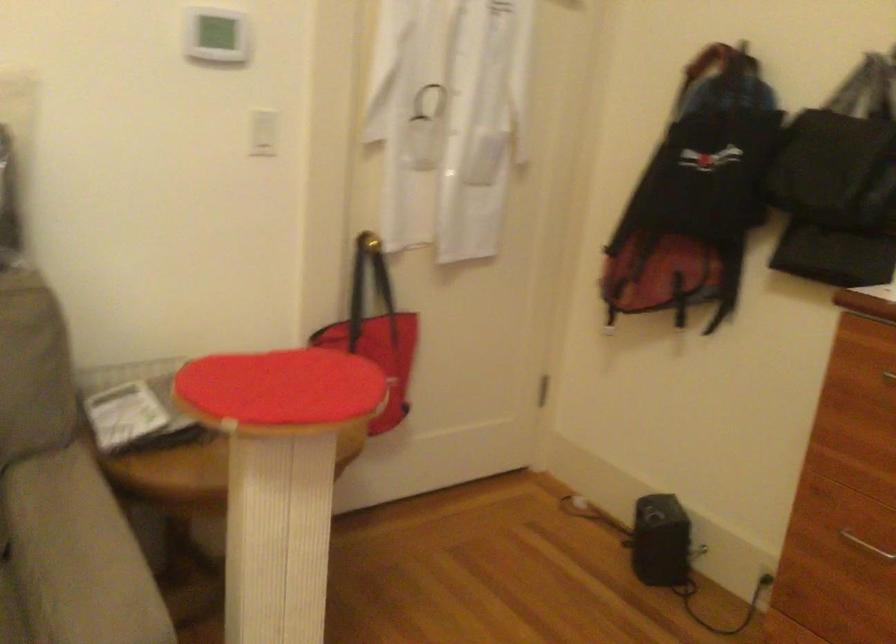
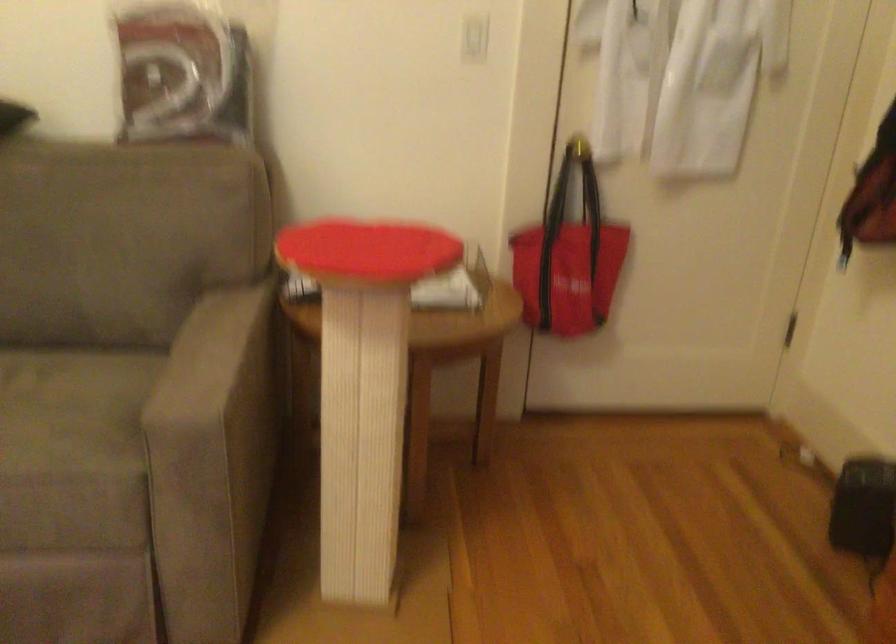
Locate, in the second image, the point that corresponds to (x=352, y=344) in the first image.

(550, 245)